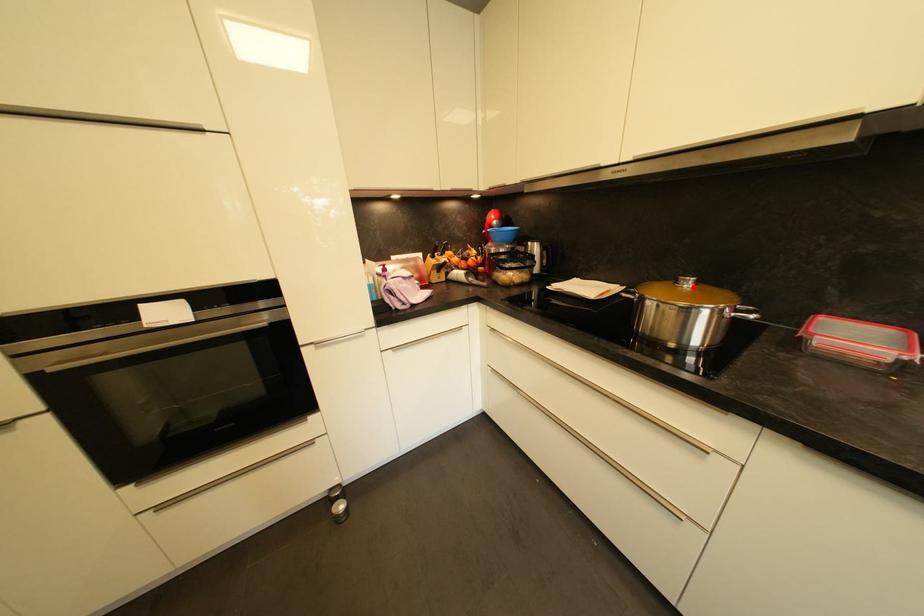
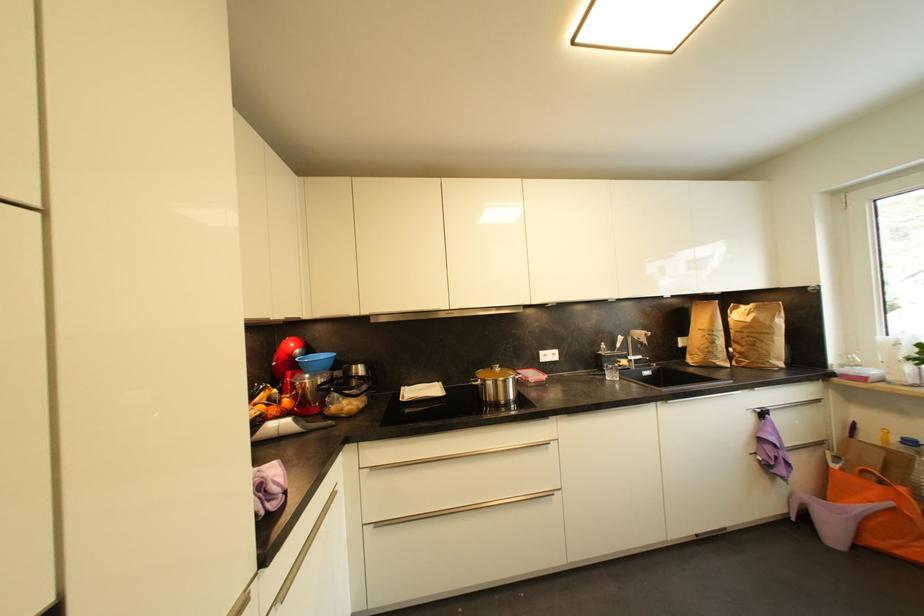
The point at the highlighted location is marked in the first image. Where is the corresponding point in the second image?

(503, 371)